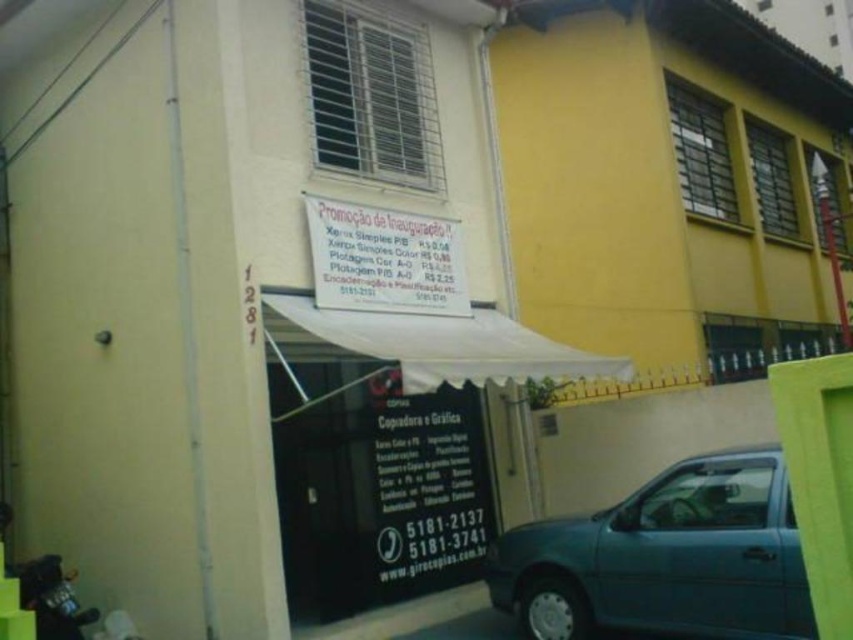
Can you confirm if white fabric canopy at center is positioned below white paper sign at center?

Correct, white fabric canopy at center is located below white paper sign at center.

Does point (416, 344) lie in front of point (436, 234)?

Yes, point (416, 344) is in front of point (436, 234).

What are the coordinates of `white fabric canopy at center` in the screenshot? It's located at (448, 346).

Identify the location of white fabric canopy at center. (448, 346).

Is point (425, 460) positioned after point (527, 358)?

Yes, point (425, 460) is behind point (527, 358).

Find the location of a particular element. black paperboard at center is located at coordinates (428, 488).

Between teal metallic car at lower right and white fabric canopy at center, which one appears on the left side from the viewer's perspective?

white fabric canopy at center

Is point (735, 458) positioned after point (392, 332)?

No.

The height and width of the screenshot is (640, 853). I want to click on teal metallic car at lower right, so click(x=665, y=557).

Locate an element on the screen. This screenshot has width=853, height=640. teal metallic car at lower right is located at coordinates [x=665, y=557].